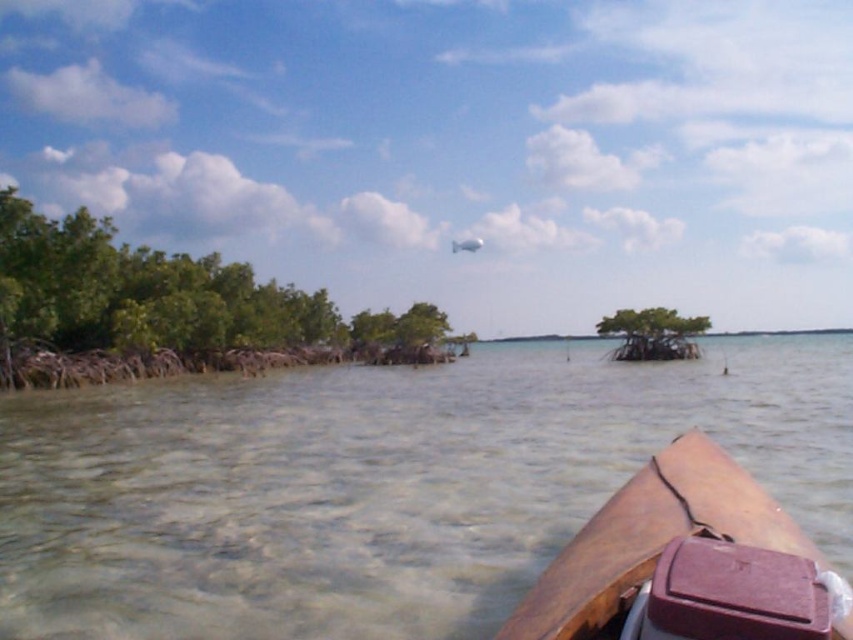
Question: Considering the relative positions of clear water at lower center and brown leather boat at lower right in the image provided, where is clear water at lower center located with respect to brown leather boat at lower right?

Choices:
 (A) below
 (B) above

Answer: (A)

Question: In this image, where is clear water at lower center located relative to brown leather boat at lower right?

Choices:
 (A) above
 (B) below

Answer: (B)

Question: Which point is closer to the camera taking this photo?

Choices:
 (A) (663, 577)
 (B) (136, 429)

Answer: (A)

Question: Which object is farther from the camera taking this photo?

Choices:
 (A) clear water at lower center
 (B) brown leather boat at lower right

Answer: (A)

Question: Considering the relative positions of clear water at lower center and brown leather boat at lower right in the image provided, where is clear water at lower center located with respect to brown leather boat at lower right?

Choices:
 (A) above
 (B) below

Answer: (B)